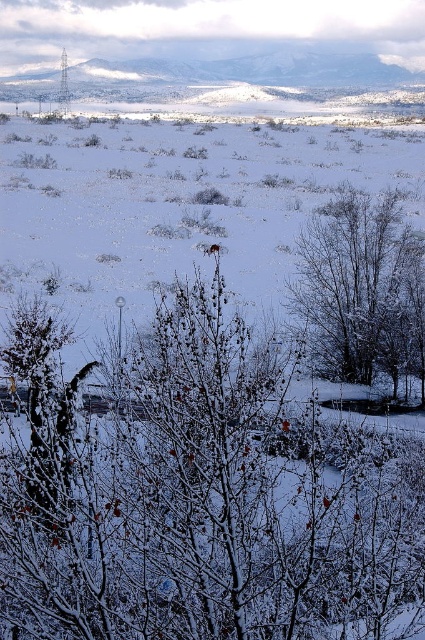
From the picture: Can you confirm if snow-covered branches at center is positioned to the left of snow-covered branches at center-right?

Indeed, snow-covered branches at center is positioned on the left side of snow-covered branches at center-right.

This screenshot has width=425, height=640. Identify the location of snow-covered branches at center. (201, 497).

At what (x,y) coordinates should I click in order to perform the action: click on snow-covered branches at center. Please return your answer as a coordinate pair (x, y). The height and width of the screenshot is (640, 425). Looking at the image, I should click on (201, 497).

Who is more distant from viewer, (173, 308) or (314, 204)?

The point (314, 204) is behind.

Which of these two, snow-covered branches at center or white powdery snow at center, stands shorter?

With less height is snow-covered branches at center.

Identify the location of snow-covered branches at center. This screenshot has height=640, width=425. (201, 497).

Find the location of a particular element. The image size is (425, 640). snow-covered branches at center is located at coordinates (201, 497).

Is point (178, 161) farther from viewer compared to point (404, 292)?

Yes.

Locate an element on the screen. Image resolution: width=425 pixels, height=640 pixels. white powdery snow at center is located at coordinates (181, 202).